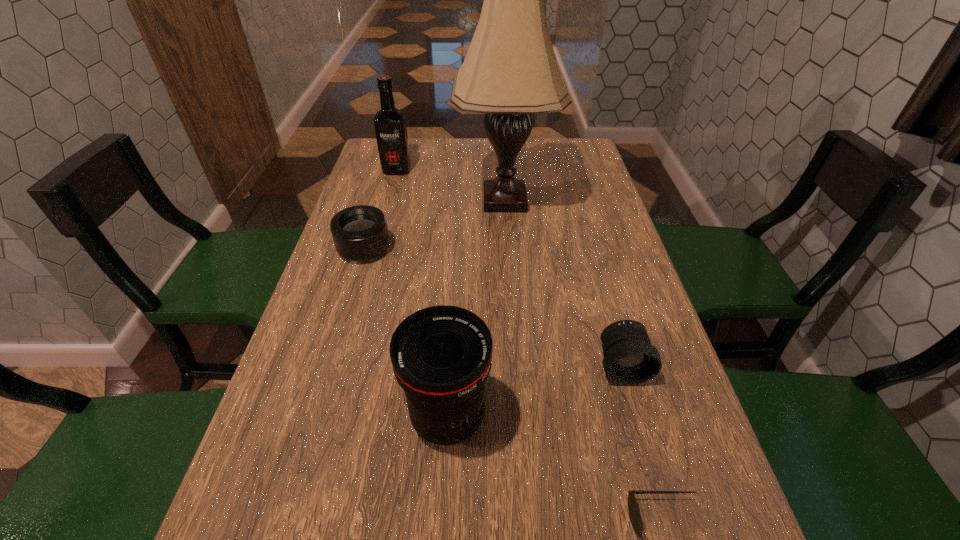
Where is `vacant area situated at the front element of the rightmost telephoto lens`? The image size is (960, 540). vacant area situated at the front element of the rightmost telephoto lens is located at coordinates point(657,489).

Locate an element on the screen. free space located 0.360m on the side of the second shortest object with brand markings and control switches is located at coordinates (531, 248).

The width and height of the screenshot is (960, 540). Identify the location of object that is at the far edge. (390, 126).

Identify the location of liquor situated at the left edge. The height and width of the screenshot is (540, 960). (390, 126).

Identify the location of telephoto lens that is at the left edge. The height and width of the screenshot is (540, 960). (360, 233).

This screenshot has height=540, width=960. I want to click on object situated at the right edge, so click(629, 358).

This screenshot has width=960, height=540. Find the location of `object located at the far left corner`. object located at the far left corner is located at coordinates (390, 126).

Identify the location of vacant space at the far edge of the desktop. (462, 171).

In order to click on free space at the left edge in this screenshot , I will do `click(309, 311)`.

The width and height of the screenshot is (960, 540). In order to click on vacant region at the right edge of the desktop in this screenshot , I will do `click(607, 218)`.